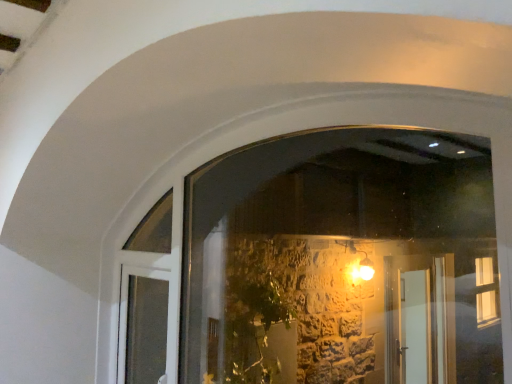
Question: Is white glossy door at lower left positioned far away from transparent glass window at center?

Choices:
 (A) no
 (B) yes

Answer: (B)

Question: Is white glossy door at lower left surrounding transparent glass window at center?

Choices:
 (A) no
 (B) yes

Answer: (A)

Question: Is white glossy door at lower left oriented away from transparent glass window at center?

Choices:
 (A) yes
 (B) no

Answer: (A)

Question: Is white glossy door at lower left outside transparent glass window at center?

Choices:
 (A) yes
 (B) no

Answer: (B)

Question: Is white glossy door at lower left at the right side of transparent glass window at center?

Choices:
 (A) yes
 (B) no

Answer: (B)

Question: Does white glossy door at lower left lie in front of transparent glass window at center?

Choices:
 (A) no
 (B) yes

Answer: (A)

Question: From the image's perspective, is transparent glass window at center under white glossy door at lower left?

Choices:
 (A) no
 (B) yes

Answer: (A)

Question: Considering the relative sizes of transparent glass window at center and white glossy door at lower left in the image provided, is transparent glass window at center wider than white glossy door at lower left?

Choices:
 (A) yes
 (B) no

Answer: (B)

Question: From a real-world perspective, is transparent glass window at center positioned over white glossy door at lower left based on gravity?

Choices:
 (A) yes
 (B) no

Answer: (A)

Question: Is transparent glass window at center at the right side of white glossy door at lower left?

Choices:
 (A) yes
 (B) no

Answer: (A)

Question: Can you confirm if transparent glass window at center is shorter than white glossy door at lower left?

Choices:
 (A) no
 (B) yes

Answer: (A)

Question: Can you confirm if transparent glass window at center is taller than white glossy door at lower left?

Choices:
 (A) yes
 (B) no

Answer: (A)

Question: Is transparent glass window at center situated inside white glossy door at lower left or outside?

Choices:
 (A) outside
 (B) inside

Answer: (A)